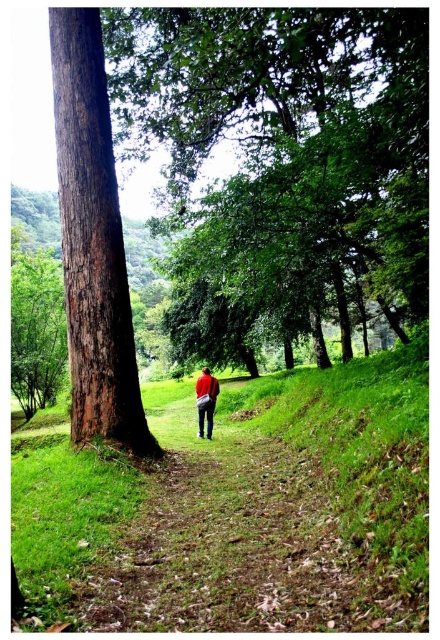
You are a hiker who wants to take a photo of the red fabric backpack at center while standing near the brown rough bark tree at left. Can you see the backpack clearly from your current position?

The brown rough bark tree at left is in front of the red fabric backpack at center, so the tree may block your view of the backpack. Move to a different position to get a clear view.

You are standing at the starting point of the dirt path and want to reach the brown rough bark tree at left. Which direction should you walk to get there?

The brown rough bark tree at left is located at point [92,243], so you should walk to the left side of the path to reach it.